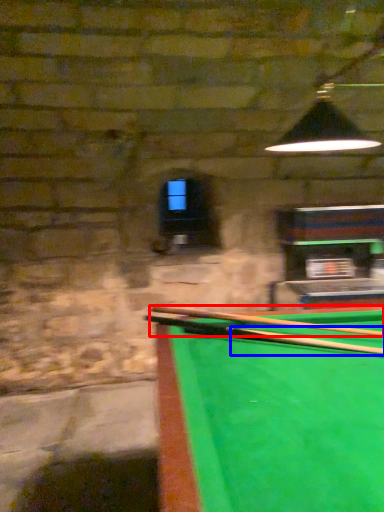
Question: Which of the following is the farthest to the observer, cue (highlighted by a red box) or cue (highlighted by a blue box)?

Choices:
 (A) cue
 (B) cue

Answer: (A)